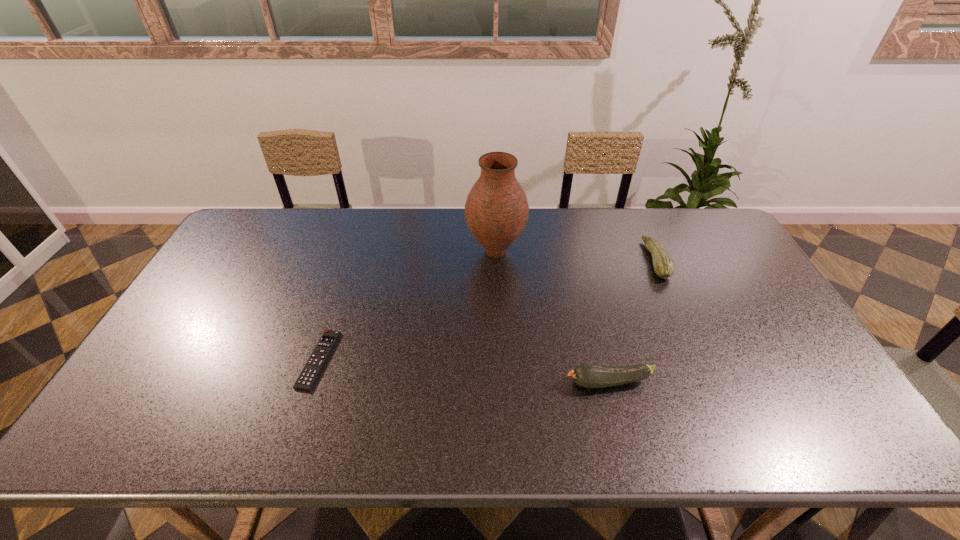
The height and width of the screenshot is (540, 960). What are the coordinates of `vacant area situated at the stem end of the rightmost object` in the screenshot? It's located at (603, 260).

You are a GUI agent. You are given a task and a screenshot of the screen. Output one action in this format:
    pyautogui.click(x=<x>, y=<y>)
    Task: Click on the vacant region located 0.070m at the stem end of the rightmost object
    Image resolution: width=960 pixels, height=540 pixels.
    Given the screenshot: What is the action you would take?
    (625, 260)

Locate an element on the screen. vacant space located 0.370m at the blossom end of the left zucchini is located at coordinates (416, 382).

Locate an element on the screen. blank space located at the blossom end of the left zucchini is located at coordinates (544, 382).

Identify the location of vacant space situated at the blossom end of the left zucchini. The height and width of the screenshot is (540, 960). (512, 382).

Identify the location of vacant region located on the back of the leftmost object. (348, 273).

You are a GUI agent. You are given a task and a screenshot of the screen. Output one action in this format:
    pyautogui.click(x=<x>, y=<y>)
    Task: Click on the vase that is at the far edge
    The width and height of the screenshot is (960, 540).
    Given the screenshot: What is the action you would take?
    pyautogui.click(x=496, y=211)

You are a GUI agent. You are given a task and a screenshot of the screen. Output one action in this format:
    pyautogui.click(x=<x>, y=<y>)
    Task: Click on the zucchini at the far edge
    This screenshot has height=540, width=960.
    Given the screenshot: What is the action you would take?
    pyautogui.click(x=664, y=267)

Where is `blank space at the far edge of the desktop`? The image size is (960, 540). blank space at the far edge of the desktop is located at coordinates (576, 230).

In the image, there is a desktop. Where is `vacant space at the near edge`? This screenshot has width=960, height=540. vacant space at the near edge is located at coordinates (518, 443).